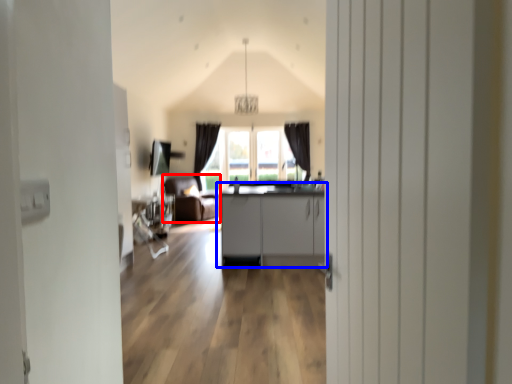
Question: Which of the following is the farthest to the observer, armchair (highlighted by a red box) or cabinetry (highlighted by a blue box)?

Choices:
 (A) armchair
 (B) cabinetry

Answer: (A)